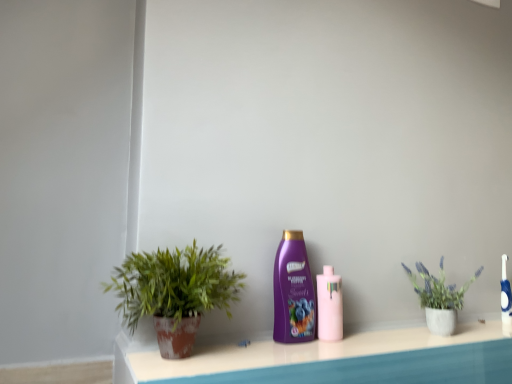
Question: From a real-world perspective, is green matte plant pot at left, the second houseplant in the back-to-front sequence, under matte concrete pot at right, which is the 1th houseplant in right-to-left order?

Choices:
 (A) yes
 (B) no

Answer: (B)

Question: From the image's perspective, would you say green matte plant pot at left, the first houseplant in the left-to-right sequence, is positioned over matte concrete pot at right, arranged as the 2th houseplant when viewed from the front?

Choices:
 (A) yes
 (B) no

Answer: (A)

Question: Considering the relative sizes of green matte plant pot at left, which ranks as the second houseplant in right-to-left order, and matte concrete pot at right, which is the second houseplant in left-to-right order, in the image provided, is green matte plant pot at left, which ranks as the second houseplant in right-to-left order, smaller than matte concrete pot at right, which is the second houseplant in left-to-right order,?

Choices:
 (A) yes
 (B) no

Answer: (B)

Question: From the image's perspective, is green matte plant pot at left, which is the 1th houseplant in front-to-back order, beneath matte concrete pot at right, which is the second houseplant in left-to-right order?

Choices:
 (A) yes
 (B) no

Answer: (B)

Question: Is green matte plant pot at left, the first houseplant in the left-to-right sequence, with matte concrete pot at right, which is the 1th houseplant in right-to-left order?

Choices:
 (A) no
 (B) yes

Answer: (A)

Question: Choose the correct answer: Is pink glossy bottle at center, acting as the 2th bottle starting from the left, inside green matte plant pot at left, which is the 1th houseplant in front-to-back order, or outside it?

Choices:
 (A) outside
 (B) inside

Answer: (A)

Question: Considering the relative positions of pink glossy bottle at center, the first bottle viewed from the right, and green matte plant pot at left, the first houseplant in the left-to-right sequence, in the image provided, is pink glossy bottle at center, the first bottle viewed from the right, to the left or to the right of green matte plant pot at left, the first houseplant in the left-to-right sequence,?

Choices:
 (A) left
 (B) right

Answer: (B)

Question: In terms of width, does pink glossy bottle at center, the first bottle viewed from the right, look wider or thinner when compared to green matte plant pot at left, which is the 1th houseplant in front-to-back order?

Choices:
 (A) thin
 (B) wide

Answer: (A)

Question: From the image's perspective, is pink glossy bottle at center, acting as the 2th bottle starting from the left, located above or below green matte plant pot at left, which ranks as the second houseplant in right-to-left order?

Choices:
 (A) above
 (B) below

Answer: (B)

Question: Is matte concrete pot at right, arranged as the 2th houseplant when viewed from the front, bigger or smaller than purple glossy shampoo at center, the 1th bottle when ordered from left to right?

Choices:
 (A) big
 (B) small

Answer: (A)

Question: From the image's perspective, is matte concrete pot at right, arranged as the 2th houseplant when viewed from the front, above or below purple glossy shampoo at center, placed as the second bottle when sorted from right to left?

Choices:
 (A) above
 (B) below

Answer: (B)

Question: Considering the positions of matte concrete pot at right, which is the 1th houseplant in right-to-left order, and purple glossy shampoo at center, placed as the second bottle when sorted from right to left, in the image, is matte concrete pot at right, which is the 1th houseplant in right-to-left order, wider or thinner than purple glossy shampoo at center, placed as the second bottle when sorted from right to left,?

Choices:
 (A) wide
 (B) thin

Answer: (A)

Question: Would you say matte concrete pot at right, which is the second houseplant in left-to-right order, is inside or outside purple glossy shampoo at center, the 1th bottle when ordered from left to right?

Choices:
 (A) outside
 (B) inside

Answer: (A)

Question: Does point (293, 284) appear closer or farther from the camera than point (211, 304)?

Choices:
 (A) closer
 (B) farther

Answer: (B)

Question: Considering their positions, is purple glossy shampoo at center, the 1th bottle when ordered from left to right, located in front of or behind green matte plant pot at left, which ranks as the second houseplant in right-to-left order?

Choices:
 (A) front
 (B) behind

Answer: (B)